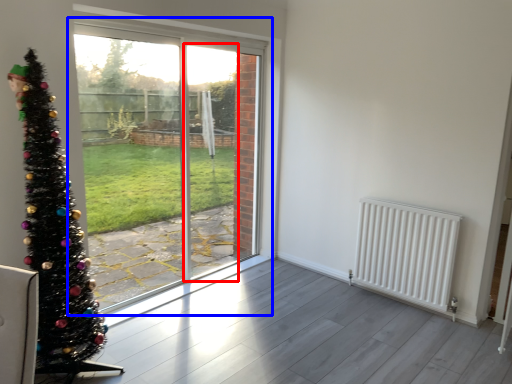
Question: Which point is closer to the camera, screen door (highlighted by a red box) or window (highlighted by a blue box)?

Choices:
 (A) screen door
 (B) window

Answer: (B)